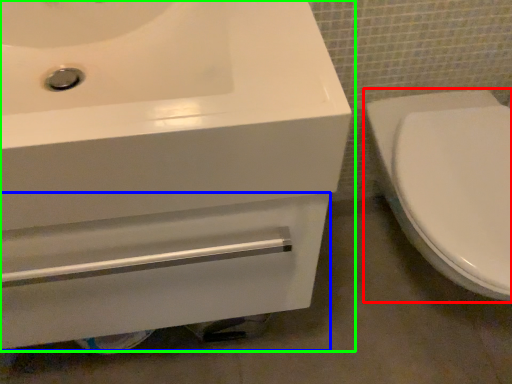
Question: Which object is positioned closest to toilet (highlighted by a red box)? Select from drawer (highlighted by a blue box) and sink (highlighted by a green box).

Choices:
 (A) drawer
 (B) sink

Answer: (A)